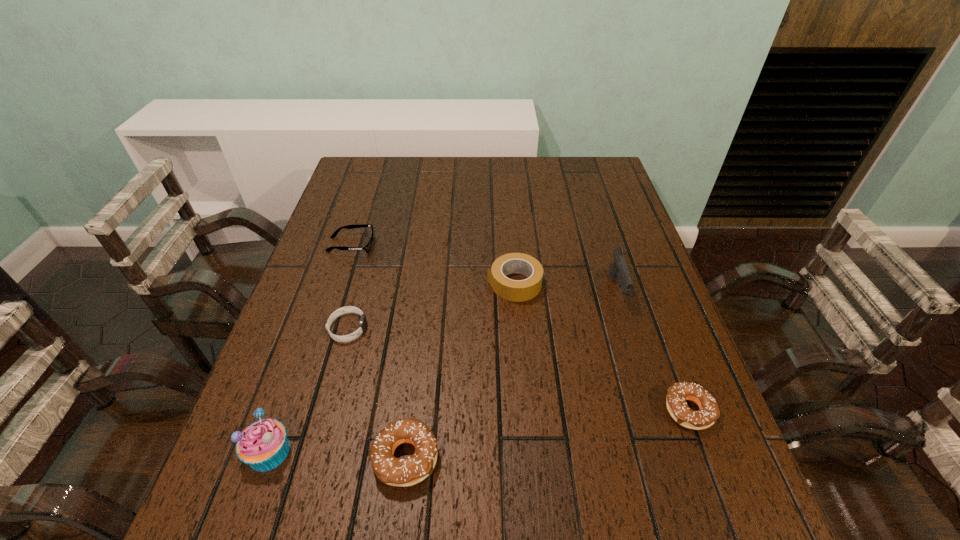
The height and width of the screenshot is (540, 960). I want to click on location for an additional doughnut to make spacing equal, so click(x=553, y=433).